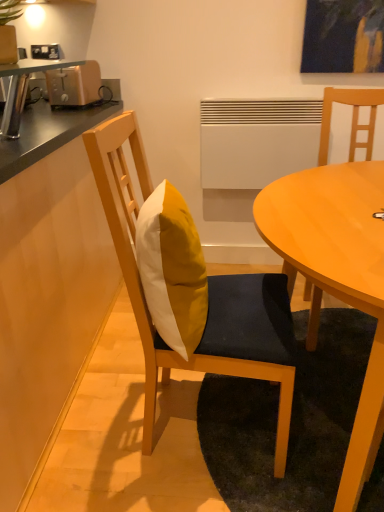
Question: Can you confirm if yellow fabric cushion at center, which is the first chair from left to right, is smaller than matte wood table at center?

Choices:
 (A) yes
 (B) no

Answer: (A)

Question: Is yellow fabric cushion at center, marked as the second chair in a right-to-left arrangement, wider than matte wood table at center?

Choices:
 (A) yes
 (B) no

Answer: (B)

Question: Does yellow fabric cushion at center, which is the first chair from left to right, have a lesser height compared to matte wood table at center?

Choices:
 (A) yes
 (B) no

Answer: (B)

Question: From the image's perspective, is yellow fabric cushion at center, which is the first chair from left to right, located beneath matte wood table at center?

Choices:
 (A) no
 (B) yes

Answer: (A)

Question: Is yellow fabric cushion at center, which is the first chair from left to right, at the left side of matte wood table at center?

Choices:
 (A) yes
 (B) no

Answer: (A)

Question: In terms of height, does wooden countertop at left look taller or shorter compared to metallic gold toaster at left?

Choices:
 (A) tall
 (B) short

Answer: (A)

Question: Is wooden countertop at left in front of or behind metallic gold toaster at left in the image?

Choices:
 (A) front
 (B) behind

Answer: (A)

Question: From a real-world perspective, is wooden countertop at left positioned above or below metallic gold toaster at left?

Choices:
 (A) above
 (B) below

Answer: (B)

Question: In the image, is wooden countertop at left on the left side or the right side of metallic gold toaster at left?

Choices:
 (A) left
 (B) right

Answer: (A)

Question: Choose the correct answer: Is yellow fabric pillow at center inside metallic gold toaster at left or outside it?

Choices:
 (A) outside
 (B) inside

Answer: (A)

Question: From the image's perspective, is yellow fabric pillow at center located above or below metallic gold toaster at left?

Choices:
 (A) below
 (B) above

Answer: (A)

Question: Is yellow fabric pillow at center taller or shorter than metallic gold toaster at left?

Choices:
 (A) tall
 (B) short

Answer: (A)

Question: Does point (172, 250) appear closer or farther from the camera than point (91, 102)?

Choices:
 (A) farther
 (B) closer

Answer: (B)

Question: In the image, is yellow fabric cushion at center, marked as the second chair in a right-to-left arrangement, on the left side or the right side of metallic gold toaster at left?

Choices:
 (A) right
 (B) left

Answer: (A)

Question: Considering the positions of yellow fabric cushion at center, marked as the second chair in a right-to-left arrangement, and metallic gold toaster at left in the image, is yellow fabric cushion at center, marked as the second chair in a right-to-left arrangement, taller or shorter than metallic gold toaster at left?

Choices:
 (A) tall
 (B) short

Answer: (A)